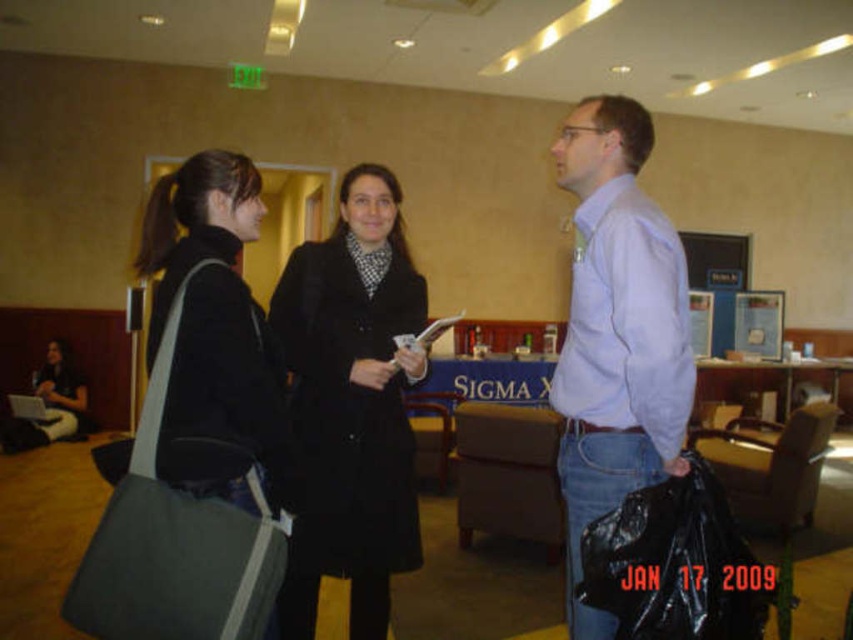
Question: Does light blue shirt at center have a larger size compared to dark green canvas bag at left?

Choices:
 (A) no
 (B) yes

Answer: (B)

Question: Which object is closer to the camera taking this photo?

Choices:
 (A) black wool coat at center
 (B) light blue shirt at center

Answer: (B)

Question: Among these points, which one is farthest from the camera?

Choices:
 (A) (251, 195)
 (B) (328, 378)
 (C) (619, 272)

Answer: (B)

Question: Which point is closer to the camera?

Choices:
 (A) (186, 218)
 (B) (612, 324)
 (C) (397, 269)

Answer: (B)

Question: Considering the relative positions of light blue shirt at center and dark green canvas bag at left in the image provided, where is light blue shirt at center located with respect to dark green canvas bag at left?

Choices:
 (A) above
 (B) below

Answer: (B)

Question: Is black wool coat at center below light blue shirt at center?

Choices:
 (A) yes
 (B) no

Answer: (A)